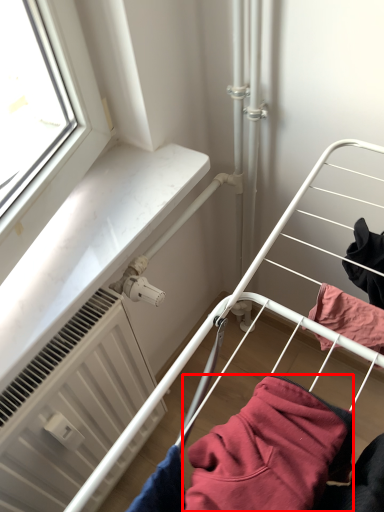
Question: Observing the image, what is the correct spatial positioning of clothing (annotated by the red box) in reference to radiator?

Choices:
 (A) right
 (B) left

Answer: (A)